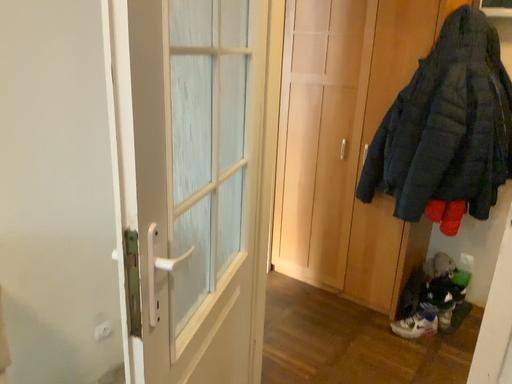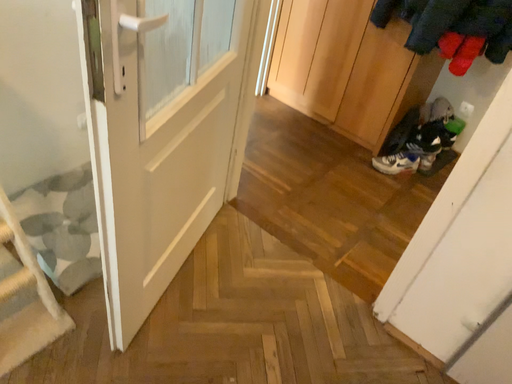
Question: Which way did the camera rotate in the video?

Choices:
 (A) rotated downward
 (B) rotated upward

Answer: (A)